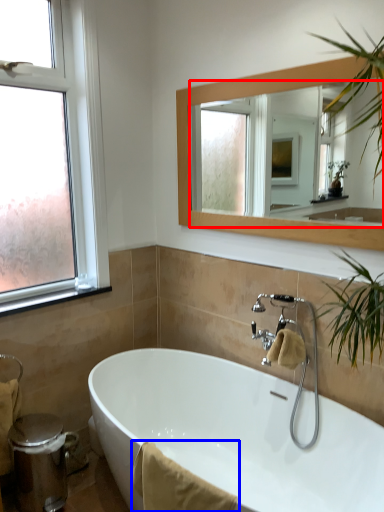
Question: Which object is further to the camera taking this photo, mirror (highlighted by a red box) or bath towel (highlighted by a blue box)?

Choices:
 (A) mirror
 (B) bath towel

Answer: (A)